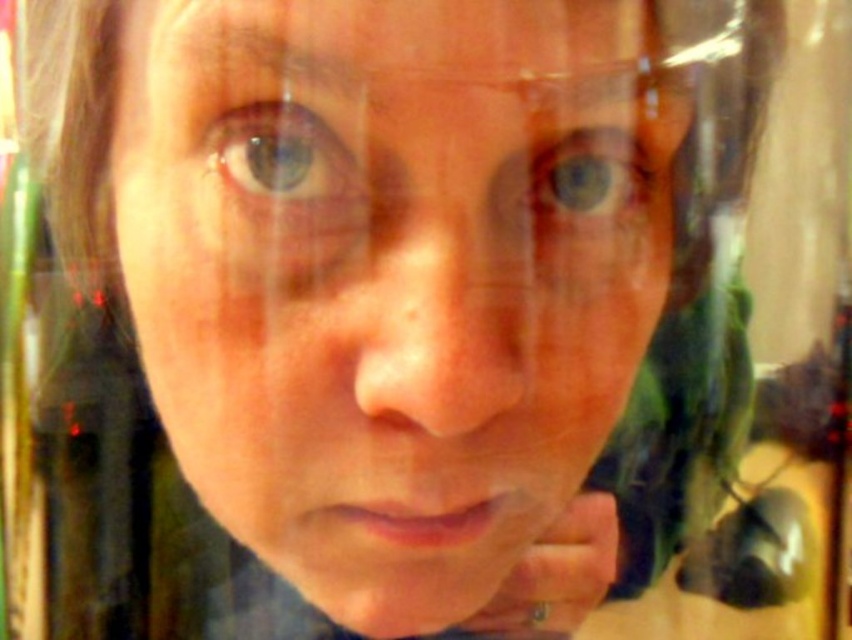
From the picture: You are a photographer trying to capture a clear reflection of the blue glossy eye at upper center in a reflective surface. If your camera is positioned 10 inches away from the eye, will you be able to achieve a clear reflection?

The blue glossy eye at upper center and camera are 9.98 inches apart from each other. Since the camera is only 0.02 inches closer than the 10 inches required, it is likely close enough to achieve a clear reflection.

You are a photographer trying to capture a clear portrait using a reflective surface. You notice the smooth skin face at center and the blue glossy eye at upper center in your reflection. Which object in the reflection takes up more space?

The smooth skin face at center is larger in size than the blue glossy eye at upper center, so the smooth skin face at center takes up more space in the reflection.

Based on the scene description, can you determine if the smooth skin face at center is wider than the blue matte eye at upper center?

The smooth skin face at center is wider than the blue matte eye at upper center according to the description.